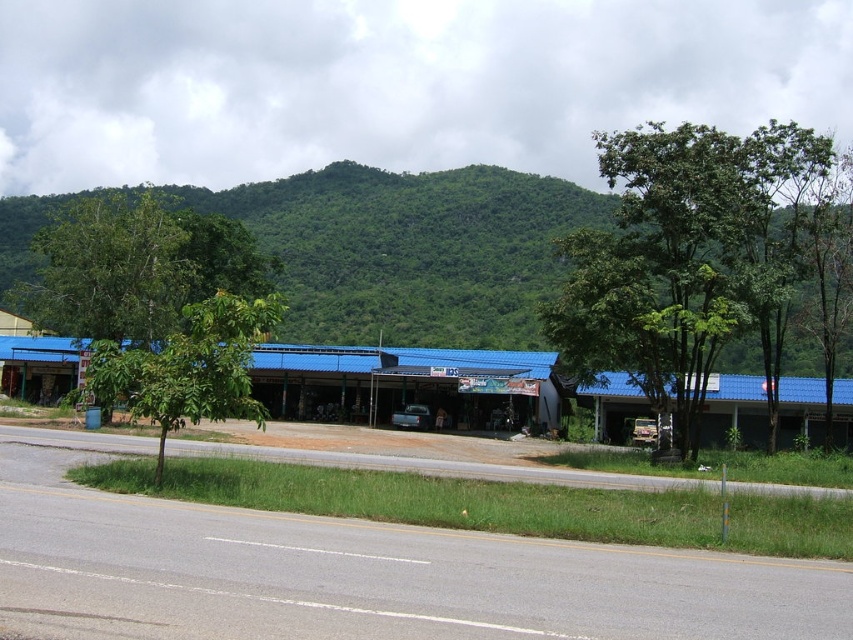
Is green leafy mountain at upper center above green leafy tree at left?

Yes.

Who is shorter, green leafy mountain at upper center or green leafy tree at left?

green leafy tree at left is shorter.

Find the location of a particular element. green leafy mountain at upper center is located at coordinates (410, 250).

Image resolution: width=853 pixels, height=640 pixels. What are the coordinates of `green leafy mountain at upper center` in the screenshot? It's located at (410, 250).

Is green leafy tree at center in front of green leafy tree at left?

No.

Is point (773, 224) positioned before point (234, 392)?

No, it is behind (234, 392).

Find the location of a particular element. Image resolution: width=853 pixels, height=640 pixels. green leafy tree at center is located at coordinates (688, 262).

Can you confirm if green leafy mountain at upper center is smaller than green leafy tree at center?

Yes.

Does green leafy mountain at upper center have a lesser height compared to green leafy tree at center?

Indeed, green leafy mountain at upper center has a lesser height compared to green leafy tree at center.

Which is behind, point (514, 314) or point (730, 330)?

Point (514, 314)

What are the coordinates of `green leafy mountain at upper center` in the screenshot? It's located at (410, 250).